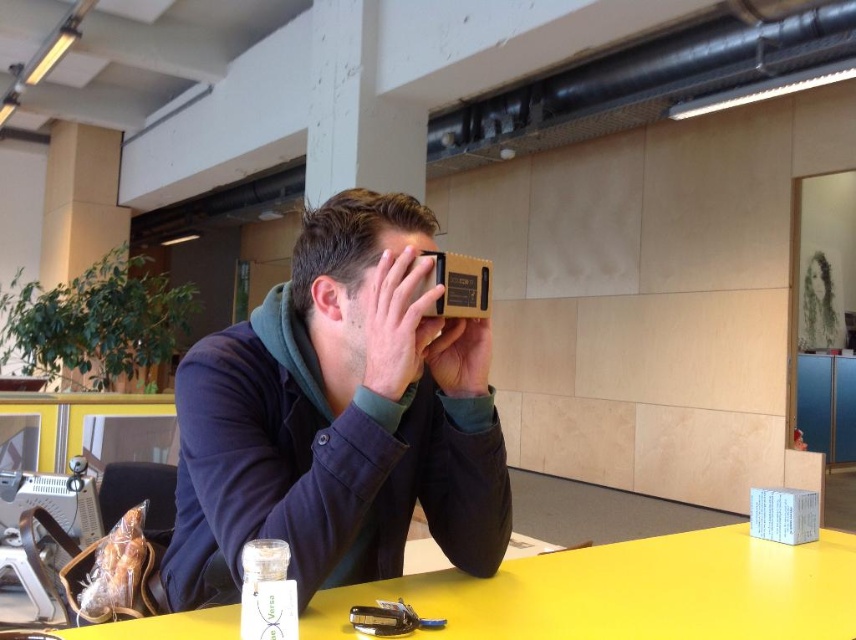
You are organizing items on a table and need to place a matte cardboard vr viewer at center and a matte brown cardboard at center. According to the scene, which item is taller?

The matte cardboard vr viewer at center is taller than the matte brown cardboard at center.

You are organizing items on a yellow table. You have a matte cardboard vr viewer at center and a matte brown cardboard at center. Which object takes up more space on the table?

The matte cardboard vr viewer at center has a larger size compared to the matte brown cardboard at center, so it takes up more space on the table.

What are the coordinates of the matte cardboard box at center?

The matte cardboard box at center is located at point coordinates of (349, 237).